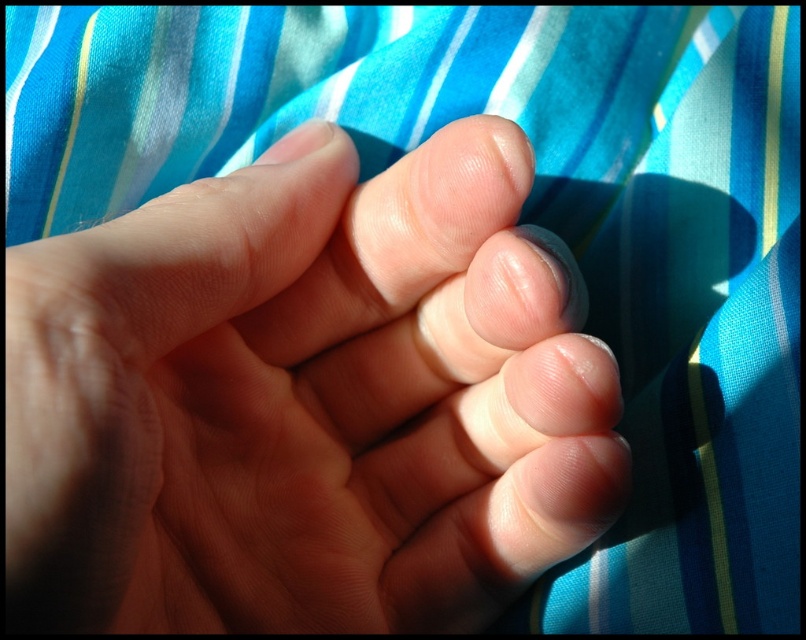
Does smooth skin hand at center have a lesser width compared to smooth skin toe at center?

No.

Can you confirm if smooth skin hand at center is taller than smooth skin toe at center?

Indeed, smooth skin hand at center has a greater height compared to smooth skin toe at center.

Find the location of a particular element. smooth skin hand at center is located at coordinates (305, 401).